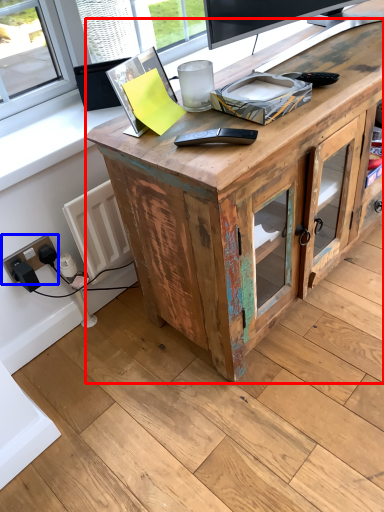
Question: Which object appears farthest to the camera in this image, desk (highlighted by a red box) or electric outlet (highlighted by a blue box)?

Choices:
 (A) desk
 (B) electric outlet

Answer: (B)